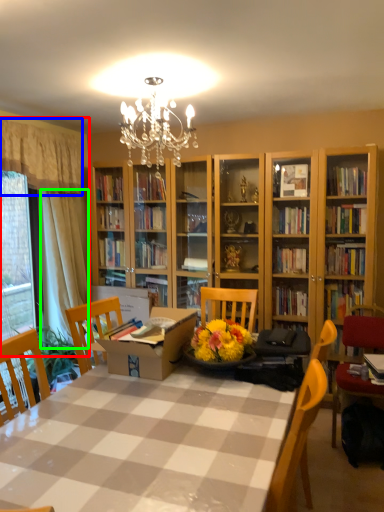
Question: Considering the real-world distances, which object is farthest from curtain (highlighted by a red box)? curtain (highlighted by a blue box) or curtain (highlighted by a green box)?

Choices:
 (A) curtain
 (B) curtain

Answer: (A)